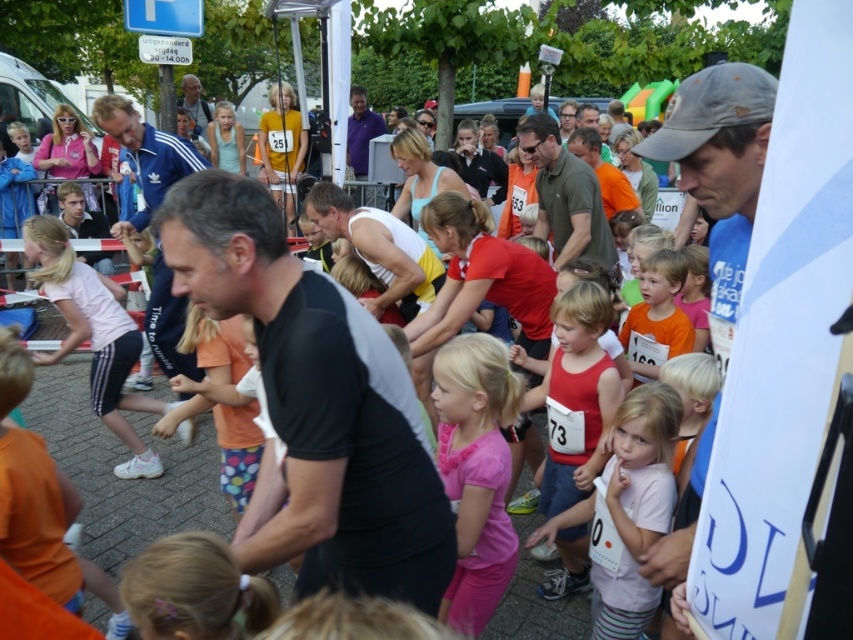
Question: Which point is closer to the camera?

Choices:
 (A) (706, 129)
 (B) (628, 323)

Answer: (A)

Question: Which object is positioned closest to the matte red tank top at center?

Choices:
 (A) orange cotton shirt at center
 (B) gray fabric cap at upper right
 (C) green matte shirt at center

Answer: (A)

Question: From the image, what is the correct spatial relationship of pink matte shirt at center in relation to green matte shirt at center?

Choices:
 (A) below
 (B) above

Answer: (A)

Question: Is pink fabric dress at center positioned behind matte black tank top at center?

Choices:
 (A) no
 (B) yes

Answer: (A)

Question: Considering the real-world distances, which object is closest to the black matte shirt at center?

Choices:
 (A) matte red tank top at center
 (B) orange cotton shirt at center
 (C) orange polka dot leggings at center
 (D) white matte tank top at center

Answer: (C)

Question: Does pink matte shirt at center have a lesser width compared to matte black tank top at center?

Choices:
 (A) yes
 (B) no

Answer: (A)